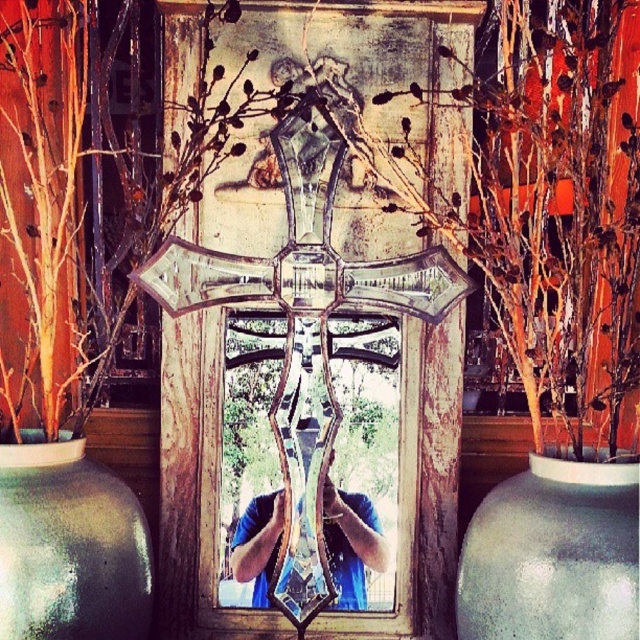
Question: Based on their relative distances, which object is farther from the matte gray vase at center?

Choices:
 (A) shiny glass cross at center
 (B) matte gray vase at lower left

Answer: (B)

Question: Can you confirm if shiny glass cross at center is positioned to the right of matte gray vase at center?

Choices:
 (A) no
 (B) yes

Answer: (A)

Question: Among these objects, which one is nearest to the camera?

Choices:
 (A) matte gray vase at center
 (B) shiny glass cross at center

Answer: (A)

Question: Does matte gray vase at center appear on the left side of matte gray vase at lower left?

Choices:
 (A) yes
 (B) no

Answer: (B)

Question: Is matte gray vase at center further to the viewer compared to matte gray vase at lower left?

Choices:
 (A) yes
 (B) no

Answer: (B)

Question: Which point is closer to the camera?

Choices:
 (A) matte gray vase at lower left
 (B) shiny glass cross at center

Answer: (A)